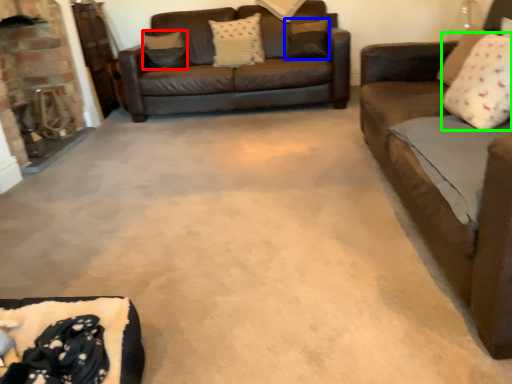
Question: Estimate the real-world distances between objects in this image. Which object is farther from pillow (highlighted by a red box), pillow (highlighted by a blue box) or pillow (highlighted by a green box)?

Choices:
 (A) pillow
 (B) pillow

Answer: (B)